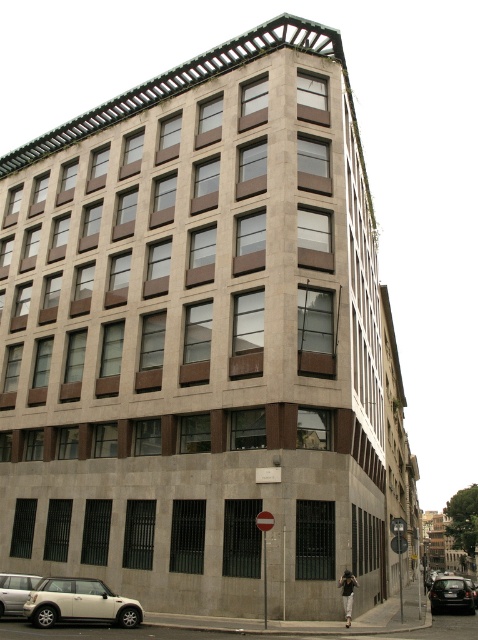
Question: Does metallic reflective sign at lower center come behind dark gray pants at lower right?

Choices:
 (A) yes
 (B) no

Answer: (B)

Question: Which point is closer to the camera?

Choices:
 (A) (119, 604)
 (B) (20, 595)
 (C) (430, 598)
 (D) (348, 588)

Answer: (A)

Question: Considering the real-world distances, which object is closest to the silver metallic car at lower left?

Choices:
 (A) white matte car at lower left
 (B) dark gray pants at lower right

Answer: (A)

Question: Does white matte car at lower left appear on the left side of dark gray pants at lower right?

Choices:
 (A) yes
 (B) no

Answer: (A)

Question: Does white matte car at lower left have a greater width compared to metallic reflective sign at lower center?

Choices:
 (A) no
 (B) yes

Answer: (B)

Question: Which object is closer to the camera taking this photo?

Choices:
 (A) metallic reflective sign at lower center
 (B) shiny black car at lower right
 (C) dark gray pants at lower right

Answer: (A)